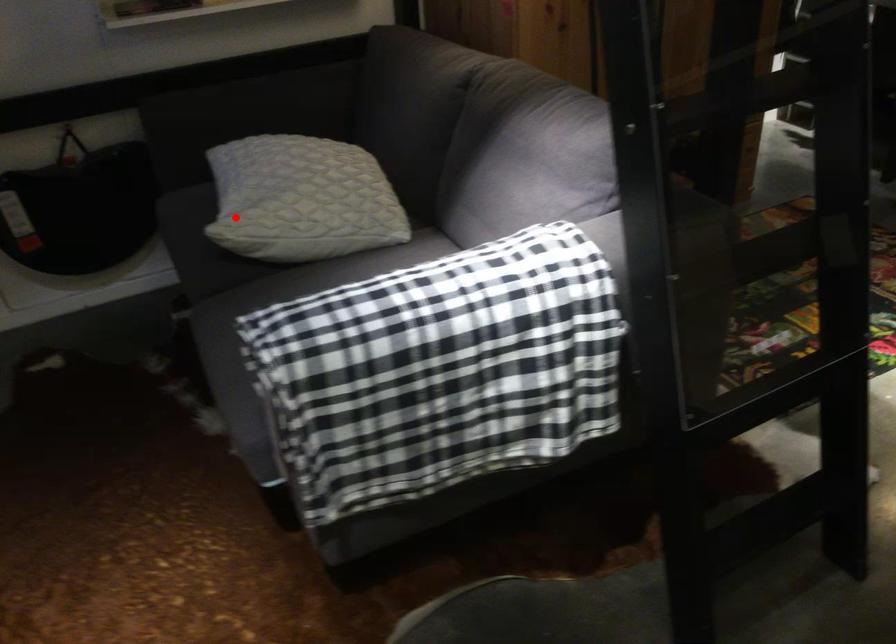
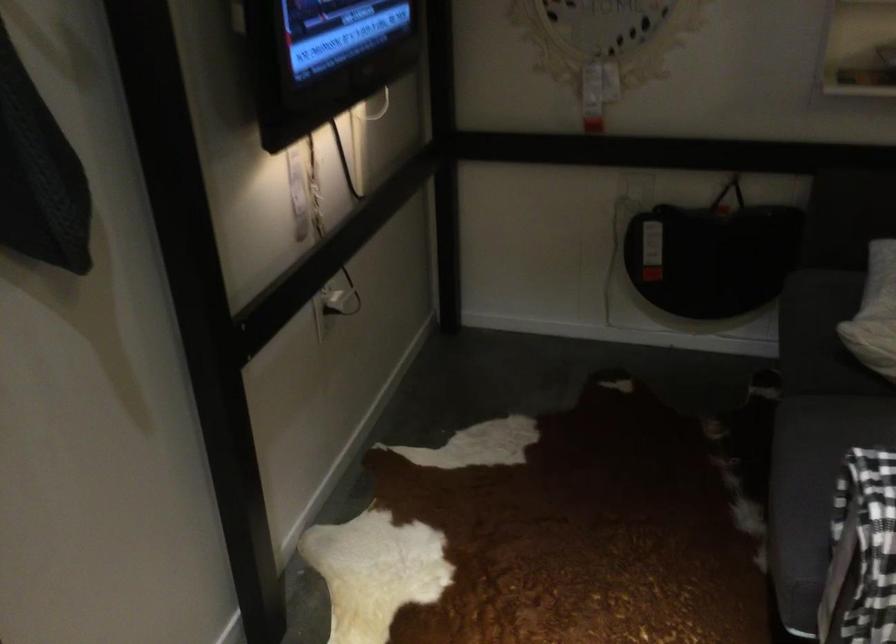
Question: A red point is marked in image1. In image2, is the corresponding 3D point closer to the camera or farther? Reply with the corresponding letter.

Choices:
 (A) The corresponding 3D point is closer.
 (B) The corresponding 3D point is farther.

Answer: (A)